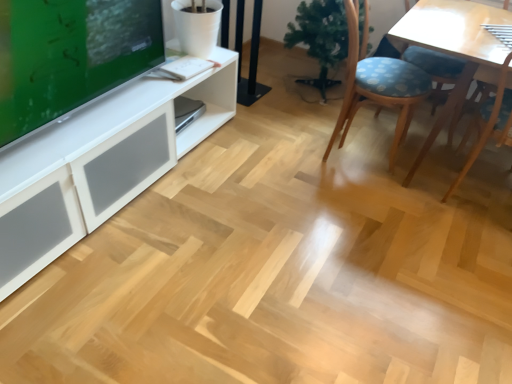
Image resolution: width=512 pixels, height=384 pixels. In order to click on free spot below green matte artificial plant at center (from a real-world perspective) in this screenshot , I will do `click(313, 94)`.